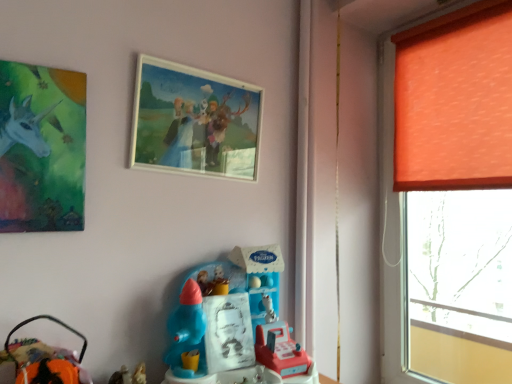
Question: In terms of height, does orange fabric curtain at right look taller or shorter compared to wooden picture frame at upper center, placed as the first picture frame when sorted from right to left?

Choices:
 (A) tall
 (B) short

Answer: (A)

Question: Is orange fabric curtain at right in front of or behind wooden picture frame at upper center, the second picture frame from the left, in the image?

Choices:
 (A) front
 (B) behind

Answer: (B)

Question: Estimate the real-world distances between objects in this image. Which object is farther from the orange fabric window at right?

Choices:
 (A) orange fabric curtain at right
 (B) wooden picture frame at upper center, the second picture frame from the left
 (C) matte green painting at upper left, arranged as the 2th picture frame when viewed from the back
 (D) plastic toy at center, marked as the 1th toy in a right-to-left arrangement
 (E) velvet orange plush at lower left, positioned as the 2th toy in right-to-left order

Answer: (E)

Question: Which of these objects is positioned closest to the orange fabric window at right?

Choices:
 (A) matte green painting at upper left, placed as the 1th picture frame when sorted from front to back
 (B) wooden picture frame at upper center, acting as the first picture frame starting from the back
 (C) orange fabric curtain at right
 (D) velvet orange plush at lower left, which appears as the 1th toy when viewed from the left
 (E) plastic toy at center, marked as the 1th toy in a right-to-left arrangement

Answer: (C)